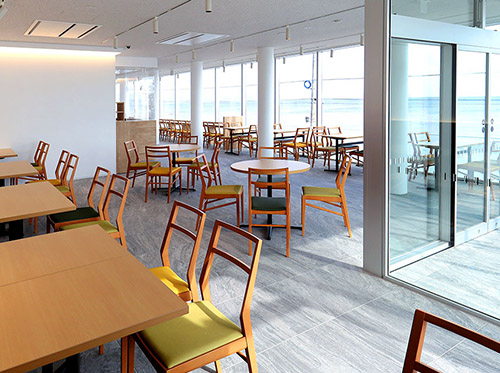
Where is `chairs on the left side of the picture`? The image size is (500, 373). chairs on the left side of the picture is located at coordinates (202, 339), (175, 280), (101, 224), (92, 209), (63, 182), (57, 176), (39, 166), (34, 157).